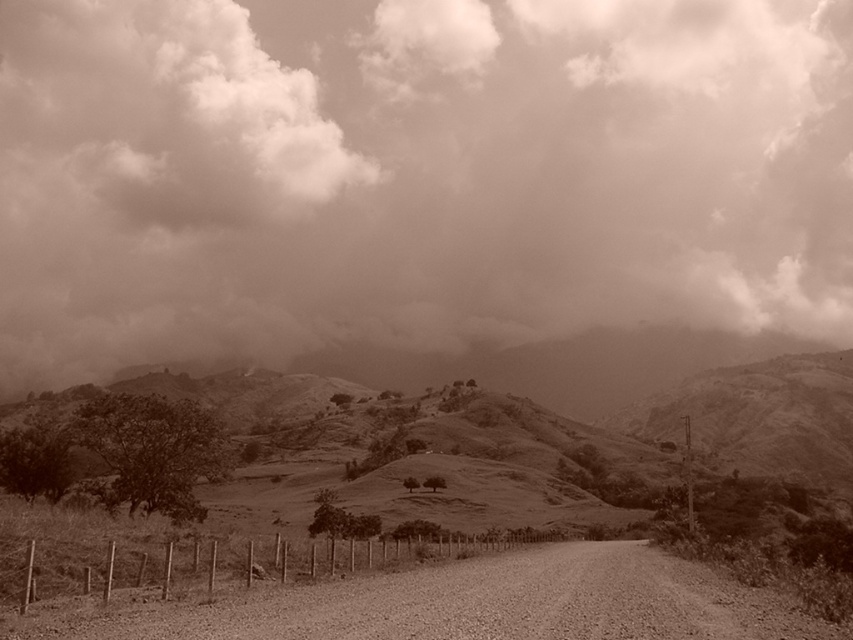
Who is lower down, cloudy sky at upper center or dirt/gravel road at center?

dirt/gravel road at center is below.

What do you see at coordinates (415, 173) in the screenshot? This screenshot has width=853, height=640. I see `cloudy sky at upper center` at bounding box center [415, 173].

This screenshot has height=640, width=853. What do you see at coordinates (415, 173) in the screenshot? I see `cloudy sky at upper center` at bounding box center [415, 173].

Where is `cloudy sky at upper center`? The height and width of the screenshot is (640, 853). cloudy sky at upper center is located at coordinates (415, 173).